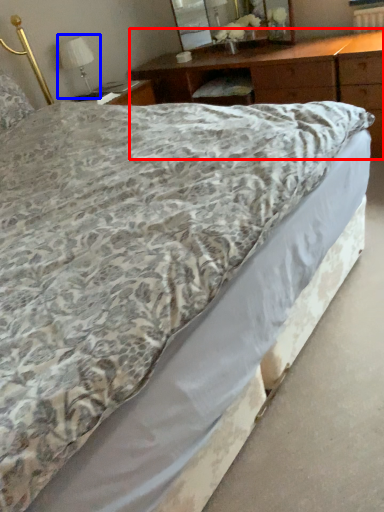
Question: Which of the following is the farthest to the observer, nightstand (highlighted by a red box) or table lamp (highlighted by a blue box)?

Choices:
 (A) nightstand
 (B) table lamp

Answer: (B)